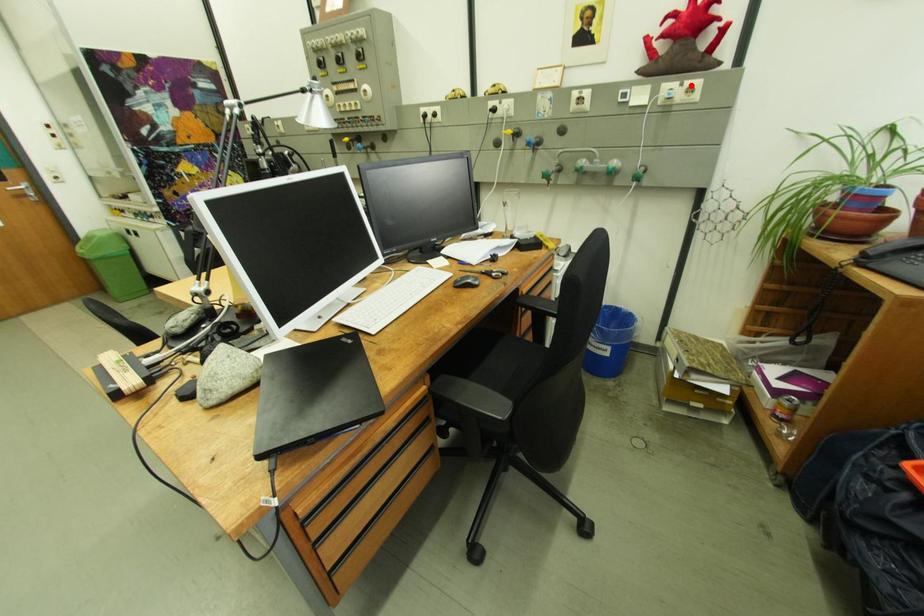
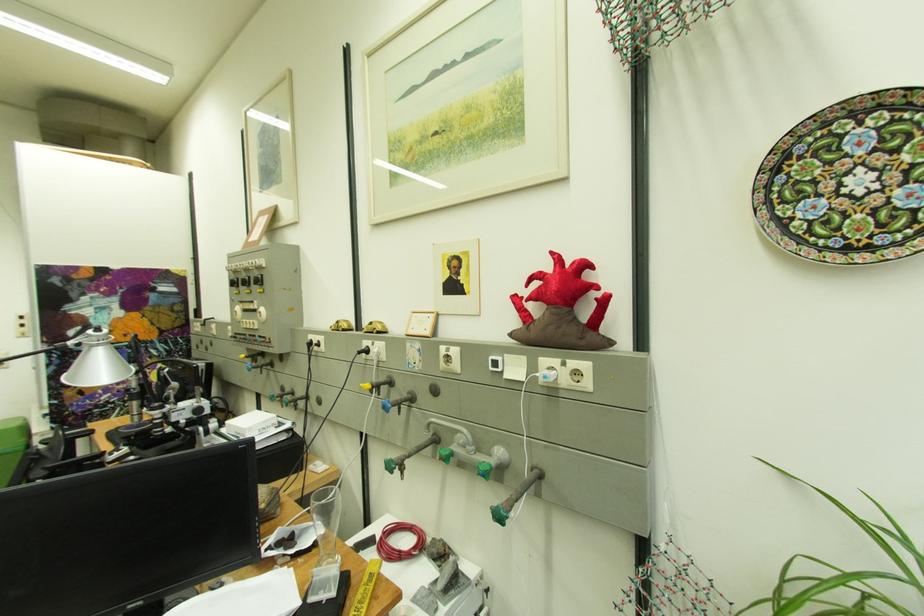
The point at the highlighted location is marked in the first image. Where is the corresponding point in the second image?

(575, 365)